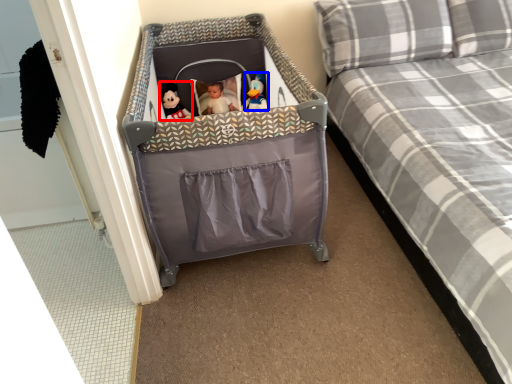
Question: Among these objects, which one is farthest to the camera, doll (highlighted by a red box) or toy (highlighted by a blue box)?

Choices:
 (A) doll
 (B) toy

Answer: (A)